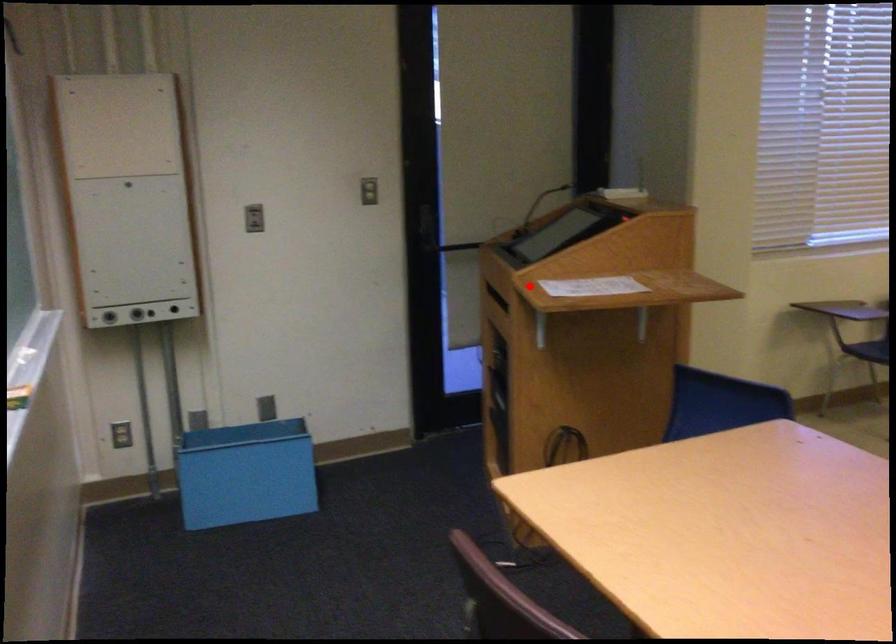
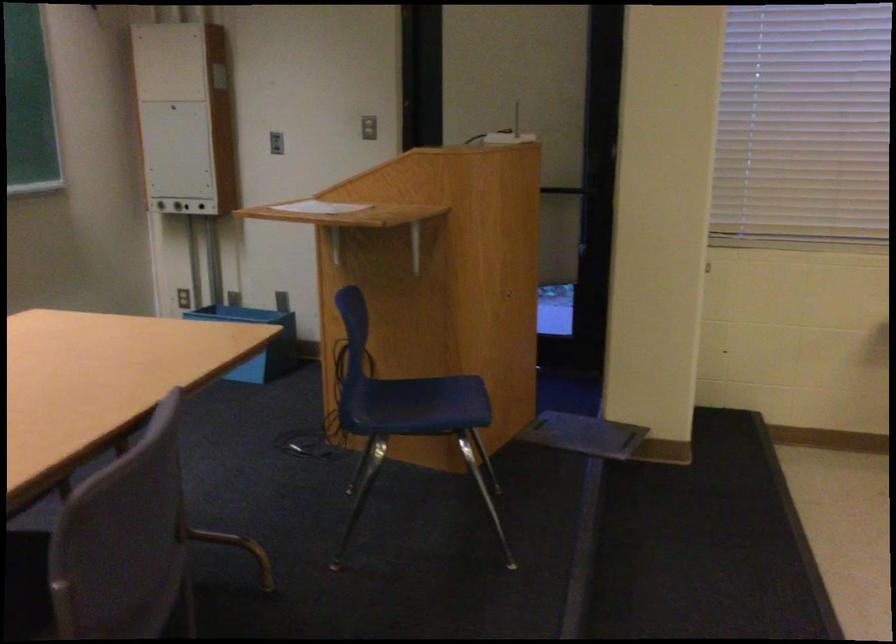
Question: I am providing you with two images of the same scene from different viewpoints. In image1, a red point is highlighted. Considering the same 3D point in image2, which of the following is correct?

Choices:
 (A) It is closer
 (B) It is farther

Answer: (B)